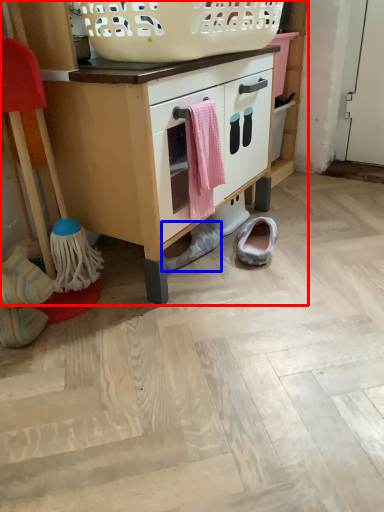
Question: Which point is further to the camera, cabinetry (highlighted by a red box) or footwear (highlighted by a blue box)?

Choices:
 (A) cabinetry
 (B) footwear

Answer: (B)